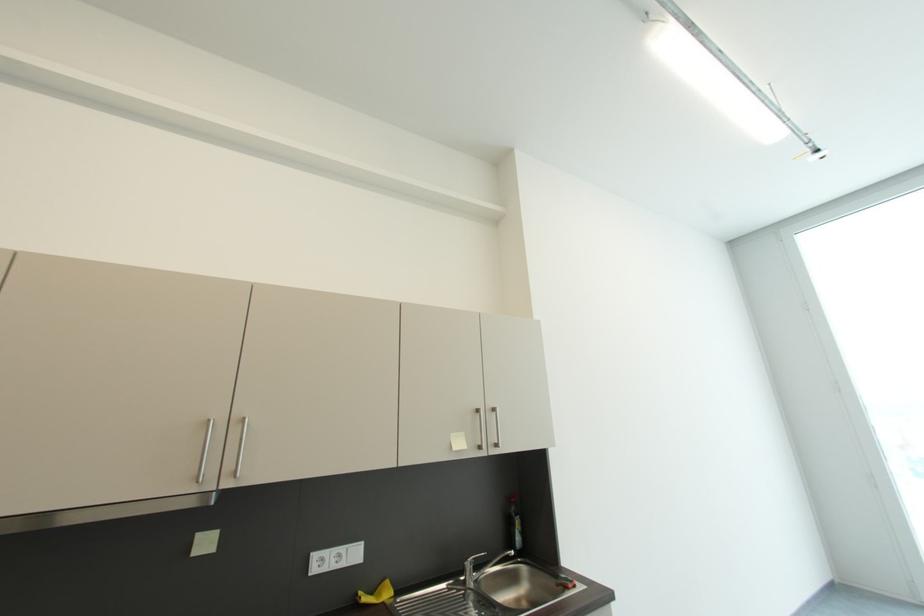
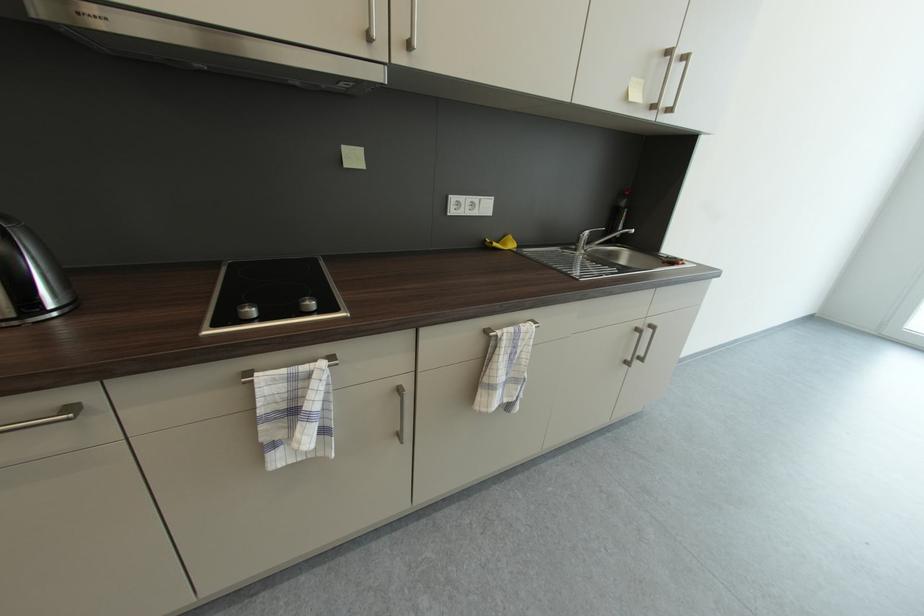
Question: The first image is from the beginning of the video and the second image is from the end. How did the camera likely rotate when shooting the video?

Choices:
 (A) Left
 (B) Right
 (C) Up
 (D) Down

Answer: (D)